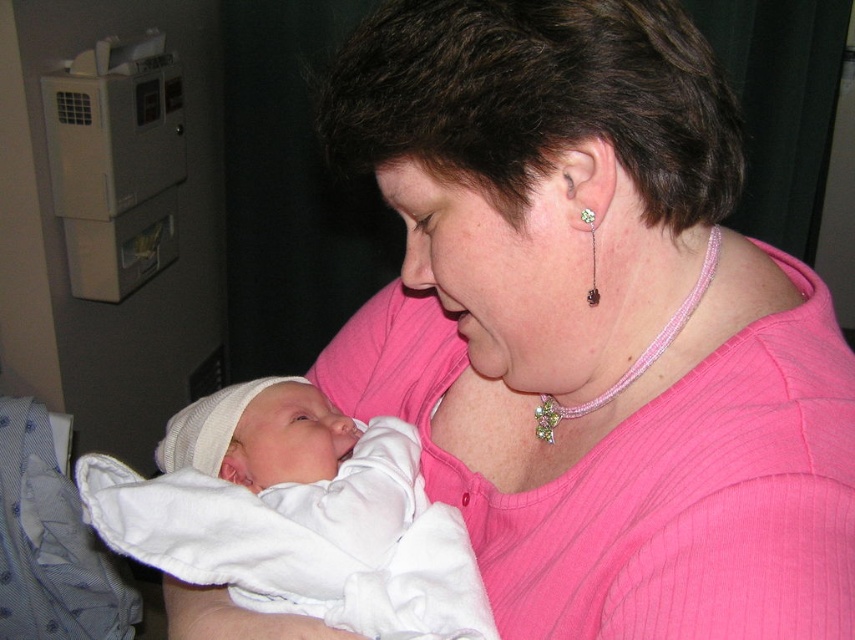
You are a nurse preparing to wrap a newborn in a blanket. You have the white soft cloth at center and the green crystal earring at ear nearby. Which item should you choose to safely wrap the baby?

The white soft cloth at center should be chosen because it is larger than the green crystal earring at ear, making it suitable for wrapping the baby safely.

You are a photographer taking a closeup shot of the newborn baby. You need to ensure that both the white soft cloth at center and the pink beaded necklace at center are visible in the frame. Given their positions, which object will appear larger in the photo?

The white soft cloth at center will appear larger in the photo because it has a greater height compared to the pink beaded necklace at center.